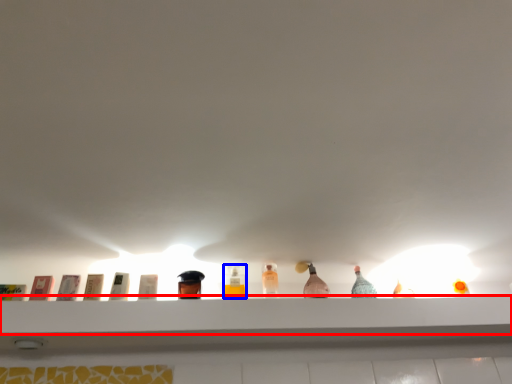
Question: Which object appears farthest to the camera in this image, shelf (highlighted by a red box) or bottle (highlighted by a blue box)?

Choices:
 (A) shelf
 (B) bottle

Answer: (B)